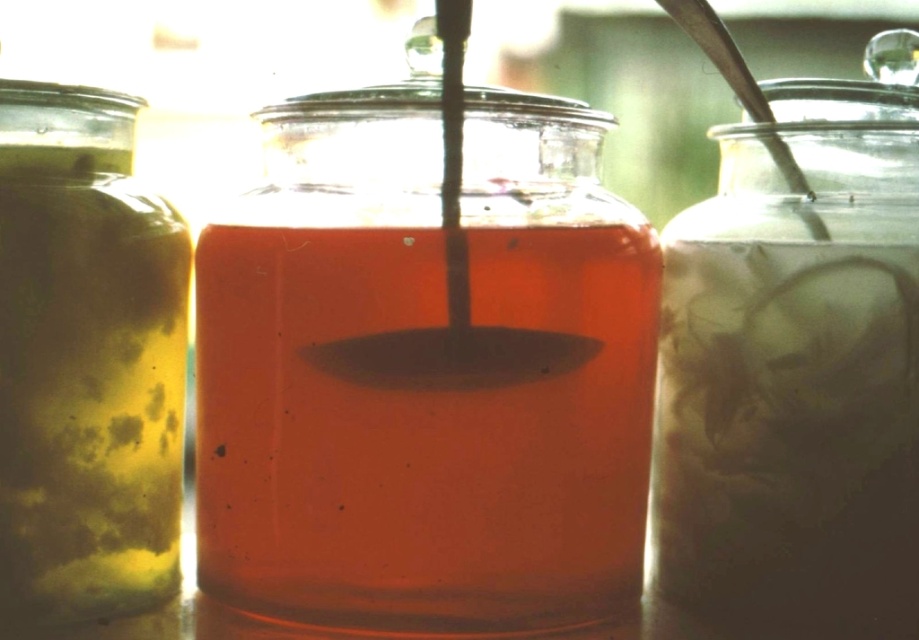
You are arranging these jars on a shelf. If you want to place the translucent glass jar at center to the left of the matte yellow glass jar at left, is that possible given their current positions?

The translucent glass jar at center is currently to the right of the matte yellow glass jar at left. To place it to the left, you would need to move it, as it cannot be done without changing their positions.

You are standing in front of three glass jars arranged in a row. You notice a point at coordinate (550, 448). Can you determine if this point is closer to you than 30 centimeters?

The point at coordinate (550, 448) is 27.13 centimeters away from the viewer, which is less than 30 centimeters. Therefore, it is closer than 30 centimeters.

You are a chef preparing a dessert and need to choose between the translucent glass jar at right and the matte yellow glass jar at left. Which jar is positioned to the right of the other?

The translucent glass jar at right is positioned to the right of the matte yellow glass jar at left.